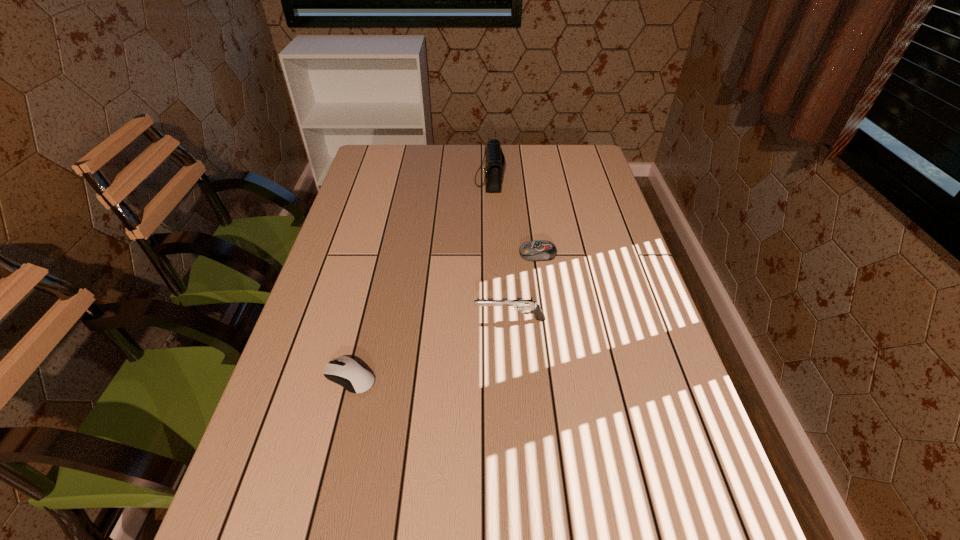
Find the location of a particular element. Image resolution: width=960 pixels, height=540 pixels. empty space between the clutch bag and the leftmost object is located at coordinates (420, 279).

At what (x,y) coordinates should I click in order to perform the action: click on free space between the nearer computer mouse and the farthest object. Please return your answer as a coordinate pair (x, y). Looking at the image, I should click on (420, 279).

Where is `empty location between the pistol and the leftmost object`? This screenshot has height=540, width=960. empty location between the pistol and the leftmost object is located at coordinates (430, 348).

Where is `vacant space that is in between the nearer computer mouse and the farther computer mouse`? vacant space that is in between the nearer computer mouse and the farther computer mouse is located at coordinates (444, 316).

Locate an element on the screen. The width and height of the screenshot is (960, 540). object that can be found as the second closest to the left computer mouse is located at coordinates (540, 250).

Select which object is the second closest to the nearer computer mouse. Please provide its 2D coordinates. Your answer should be formatted as a tuple, i.e. [(x, y)], where the tuple contains the x and y coordinates of a point satisfying the conditions above.

[(540, 250)]